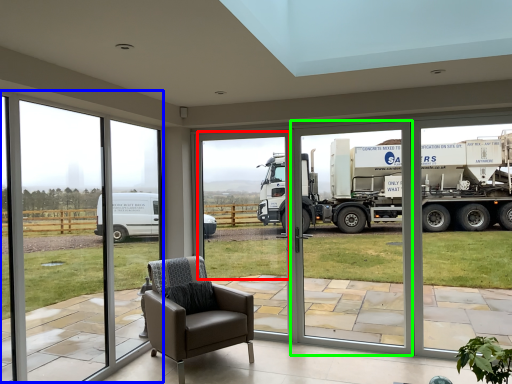
Question: Based on their relative distances, which object is nearer to window screen (highlighted by a red box)? Choose from window frame (highlighted by a blue box) and screen door (highlighted by a green box).

Choices:
 (A) window frame
 (B) screen door

Answer: (B)